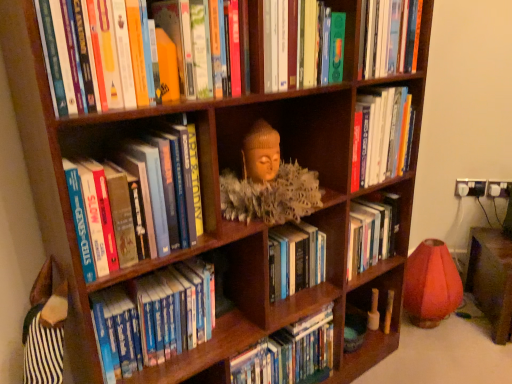
What do you see at coordinates (153, 318) in the screenshot? This screenshot has width=512, height=384. I see `blue hardcover books at center, the second book positioned from the bottom` at bounding box center [153, 318].

What is the approximate width of hardcover books at center, the 6th book viewed from the top?

It is 8.05 inches.

Find the location of a particular element. The width and height of the screenshot is (512, 384). matte wooden sculpture at center is located at coordinates (268, 182).

The height and width of the screenshot is (384, 512). What do you see at coordinates (268, 182) in the screenshot? I see `matte wooden sculpture at center` at bounding box center [268, 182].

Describe the element at coordinates (380, 135) in the screenshot. The width and height of the screenshot is (512, 384). I see `hardcover books at center, the second book in the top-to-bottom sequence` at that location.

Describe the element at coordinates (371, 233) in the screenshot. The width and height of the screenshot is (512, 384). I see `hardcover book at center, which ranks as the fourth book in top-to-bottom order` at that location.

This screenshot has width=512, height=384. I want to click on hardcover books at left, positioned as the 3th book in top-to-bottom order, so click(x=135, y=198).

At what (x,y) coordinates should I click in order to perform the action: click on blue hardcover books at center, the second book positioned from the bottom. Please return your answer as a coordinate pair (x, y). Looking at the image, I should click on (153, 318).

From a real-world perspective, who is located higher, blue hardcover books at center, the second book positioned from the bottom, or hardcover books at left, which ranks as the fourth book in bottom-to-top order?

From a 3D spatial view, hardcover books at left, which ranks as the fourth book in bottom-to-top order, is above.

Which is behind, point (115, 326) or point (156, 244)?

The point (115, 326) is farther.

Considering the sizes of objects blue hardcover books at center, the second book positioned from the bottom, and hardcover books at left, positioned as the 3th book in top-to-bottom order, in the image provided, who is thinner, blue hardcover books at center, the second book positioned from the bottom, or hardcover books at left, positioned as the 3th book in top-to-bottom order,?

blue hardcover books at center, the second book positioned from the bottom, is thinner.

Does green matte book at upper center, placed as the 6th book when sorted from bottom to top, have a lesser height compared to hardcover books at left, positioned as the 3th book in top-to-bottom order?

Yes.

Consider the image. Which object is thinner, green matte book at upper center, which is counted as the 1th book, starting from the top, or hardcover books at left, positioned as the 3th book in top-to-bottom order?

Thinner between the two is green matte book at upper center, which is counted as the 1th book, starting from the top.

From a real-world perspective, is green matte book at upper center, placed as the 6th book when sorted from bottom to top, beneath hardcover books at left, positioned as the 3th book in top-to-bottom order?

No.

Can you confirm if hardcover book at center, which appears as the 3th book when ordered from the bottom, is smaller than hardcover books at center, marked as the first book in a bottom-to-top arrangement?

Yes, hardcover book at center, which appears as the 3th book when ordered from the bottom, is smaller than hardcover books at center, marked as the first book in a bottom-to-top arrangement.

Is hardcover book at center, which ranks as the fourth book in top-to-bottom order, facing away from hardcover books at center, the 6th book viewed from the top?

No, hardcover books at center, the 6th book viewed from the top, is not at the back of hardcover book at center, which ranks as the fourth book in top-to-bottom order.

Is hardcover book at center, which ranks as the fourth book in top-to-bottom order, wider or thinner than hardcover books at center, marked as the first book in a bottom-to-top arrangement?

In the image, hardcover book at center, which ranks as the fourth book in top-to-bottom order, appears to be more narrow than hardcover books at center, marked as the first book in a bottom-to-top arrangement.

In the scene shown: Is matte wooden sculpture at center to the right of hardcover books at center, the second book in the top-to-bottom sequence, from the viewer's perspective?

Incorrect, matte wooden sculpture at center is not on the right side of hardcover books at center, the second book in the top-to-bottom sequence.

Which object is more forward, matte wooden sculpture at center or hardcover books at center, which is the 5th book from bottom to top?

matte wooden sculpture at center is closer to the camera.

Is matte wooden sculpture at center surrounding hardcover books at center, the second book in the top-to-bottom sequence?

That's incorrect, hardcover books at center, the second book in the top-to-bottom sequence, is not inside matte wooden sculpture at center.

Consider the image. Which object is wider, matte wooden sculpture at center or hardcover books at center, the second book in the top-to-bottom sequence?

Wider between the two is matte wooden sculpture at center.

Is blue hardcover books at center, the second book positioned from the bottom, a part of hardcover books at center, the second book in the top-to-bottom sequence?

That's incorrect, blue hardcover books at center, the second book positioned from the bottom, is not inside hardcover books at center, the second book in the top-to-bottom sequence.

Which is closer, (411, 113) or (172, 347)?

Point (411, 113) appears to be farther away from the viewer than point (172, 347).

Is hardcover books at center, the second book in the top-to-bottom sequence, smaller than blue hardcover books at center, the fifth book positioned from the top?

Yes, hardcover books at center, the second book in the top-to-bottom sequence, is smaller than blue hardcover books at center, the fifth book positioned from the top.

Is the position of hardcover books at center, the second book in the top-to-bottom sequence, less distant than that of blue hardcover books at center, the second book positioned from the bottom?

No, hardcover books at center, the second book in the top-to-bottom sequence, is further to the viewer.

Measure the distance from hardcover books at center, which is the 5th book from bottom to top, to matte wooden sculpture at center.

The distance of hardcover books at center, which is the 5th book from bottom to top, from matte wooden sculpture at center is 8.86 inches.

Which is more to the left, hardcover books at center, which is the 5th book from bottom to top, or matte wooden sculpture at center?

matte wooden sculpture at center.

Looking at their sizes, would you say hardcover books at center, the second book in the top-to-bottom sequence, is wider or thinner than matte wooden sculpture at center?

Clearly, hardcover books at center, the second book in the top-to-bottom sequence, has less width compared to matte wooden sculpture at center.

Is hardcover books at center, which is the 5th book from bottom to top, shorter than matte wooden sculpture at center?

Incorrect, the height of hardcover books at center, which is the 5th book from bottom to top, does not fall short of that of matte wooden sculpture at center.

Is hardcover books at center, marked as the first book in a bottom-to-top arrangement, facing towards hardcover books at left, which ranks as the fourth book in bottom-to-top order?

No, hardcover books at center, marked as the first book in a bottom-to-top arrangement, is not oriented towards hardcover books at left, which ranks as the fourth book in bottom-to-top order.

Is hardcover books at center, the 6th book viewed from the top, further to camera compared to hardcover books at left, positioned as the 3th book in top-to-bottom order?

Yes, it is behind hardcover books at left, positioned as the 3th book in top-to-bottom order.

Who is smaller, hardcover books at center, the 6th book viewed from the top, or hardcover books at left, positioned as the 3th book in top-to-bottom order?

hardcover books at center, the 6th book viewed from the top.

Are hardcover books at center, marked as the first book in a bottom-to-top arrangement, and hardcover books at left, positioned as the 3th book in top-to-bottom order, located far from each other?

No.

This screenshot has width=512, height=384. Identify the location of the 2nd book above the blue hardcover books at center, the fifth book positioned from the top (from the image's perspective). (135, 198).

You are a GUI agent. You are given a task and a screenshot of the screen. Output one action in this format:
    pyautogui.click(x=<x>, y=<y>)
    Task: Click on the book above the hardcover books at left, which ranks as the fourth book in bottom-to-top order (from a real-world perspective)
    
    Given the screenshot: What is the action you would take?
    pyautogui.click(x=302, y=45)

Considering their positions, is hardcover books at center, which is the 5th book from bottom to top, positioned further to blue hardcover books at center, the fifth book positioned from the top, than matte wooden sculpture at center?

Based on the image, hardcover books at center, which is the 5th book from bottom to top, appears to be further to blue hardcover books at center, the fifth book positioned from the top.

Looking at this image, from the image, which object appears to be nearer to blue hardcover books at center, the second book positioned from the bottom, hardcover books at left, which ranks as the fourth book in bottom-to-top order, or hardcover books at center, the second book in the top-to-bottom sequence?

Among the two, hardcover books at left, which ranks as the fourth book in bottom-to-top order, is located nearer to blue hardcover books at center, the second book positioned from the bottom.

Estimate the real-world distances between objects in this image. Which object is further from matte wooden sculpture at center, blue hardcover books at center, the fifth book positioned from the top, or hardcover books at center, which is the 5th book from bottom to top?

blue hardcover books at center, the fifth book positioned from the top, lies further to matte wooden sculpture at center than the other object.

Looking at the image, which one is located further to hardcover books at left, which ranks as the fourth book in bottom-to-top order, hardcover books at center, the 6th book viewed from the top, or blue hardcover books at center, the fifth book positioned from the top?

The object further to hardcover books at left, which ranks as the fourth book in bottom-to-top order, is hardcover books at center, the 6th book viewed from the top.

Estimate the real-world distances between objects in this image. Which object is further from hardcover book at center, which ranks as the fourth book in top-to-bottom order, green matte book at upper center, placed as the 6th book when sorted from bottom to top, or hardcover books at center, which is the 5th book from bottom to top?

green matte book at upper center, placed as the 6th book when sorted from bottom to top.

Estimate the real-world distances between objects in this image. Which object is further from hardcover book at center, which ranks as the fourth book in top-to-bottom order, green matte book at upper center, which is counted as the 1th book, starting from the top, or blue hardcover books at center, the fifth book positioned from the top?

blue hardcover books at center, the fifth book positioned from the top, lies further to hardcover book at center, which ranks as the fourth book in top-to-bottom order, than the other object.

Looking at this image, when comparing their distances from hardcover books at center, the 6th book viewed from the top, does green matte book at upper center, placed as the 6th book when sorted from bottom to top, or blue hardcover books at center, the second book positioned from the bottom, seem closer?

blue hardcover books at center, the second book positioned from the bottom, is closer to hardcover books at center, the 6th book viewed from the top.

Based on their spatial positions, is hardcover book at center, which ranks as the fourth book in top-to-bottom order, or matte wooden sculpture at center closer to hardcover books at left, positioned as the 3th book in top-to-bottom order?

matte wooden sculpture at center is positioned closer to the anchor hardcover books at left, positioned as the 3th book in top-to-bottom order.

The width and height of the screenshot is (512, 384). Identify the location of shelf located between blue hardcover books at center, the fifth book positioned from the top, and hardcover book at center, which appears as the 3th book when ordered from the bottom, in the left-right direction. (268, 182).

Identify the location of shelf that lies between green matte book at upper center, placed as the 6th book when sorted from bottom to top, and hardcover books at center, the 6th book viewed from the top, from top to bottom. (268, 182).

This screenshot has height=384, width=512. Identify the location of shelf between hardcover books at left, which ranks as the fourth book in bottom-to-top order, and hardcover book at center, which ranks as the fourth book in top-to-bottom order. (268, 182).

You are a GUI agent. You are given a task and a screenshot of the screen. Output one action in this format:
    pyautogui.click(x=<x>, y=<y>)
    Task: Click on the shelf between hardcover books at center, which is the 5th book from bottom to top, and hardcover books at center, the 6th book viewed from the top, from top to bottom
    
    Given the screenshot: What is the action you would take?
    pyautogui.click(x=268, y=182)